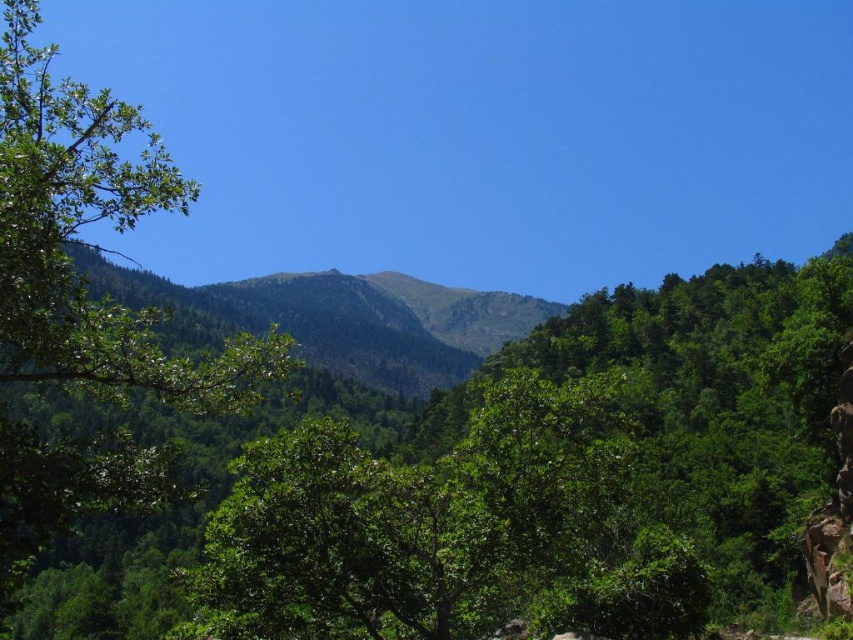
Question: Is green leafy tree at center positioned in front of green leafy tree at left?

Choices:
 (A) no
 (B) yes

Answer: (A)

Question: Is green leafy tree at center to the right of green leafy tree at left from the viewer's perspective?

Choices:
 (A) yes
 (B) no

Answer: (A)

Question: Which point is farther to the camera?

Choices:
 (A) green leafy tree at left
 (B) green leafy tree at center

Answer: (B)

Question: Among these objects, which one is farthest from the camera?

Choices:
 (A) green leafy tree at left
 (B) green leafy tree at center

Answer: (B)

Question: In this image, where is green leafy tree at center located relative to green leafy tree at left?

Choices:
 (A) left
 (B) right

Answer: (B)

Question: Which point is closer to the camera?

Choices:
 (A) green leafy tree at left
 (B) green leafy tree at center

Answer: (A)